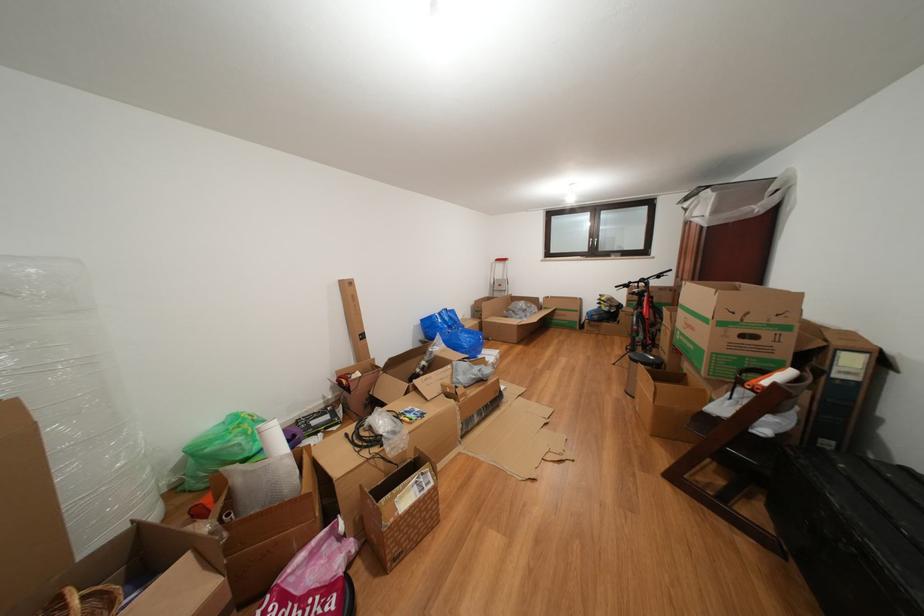
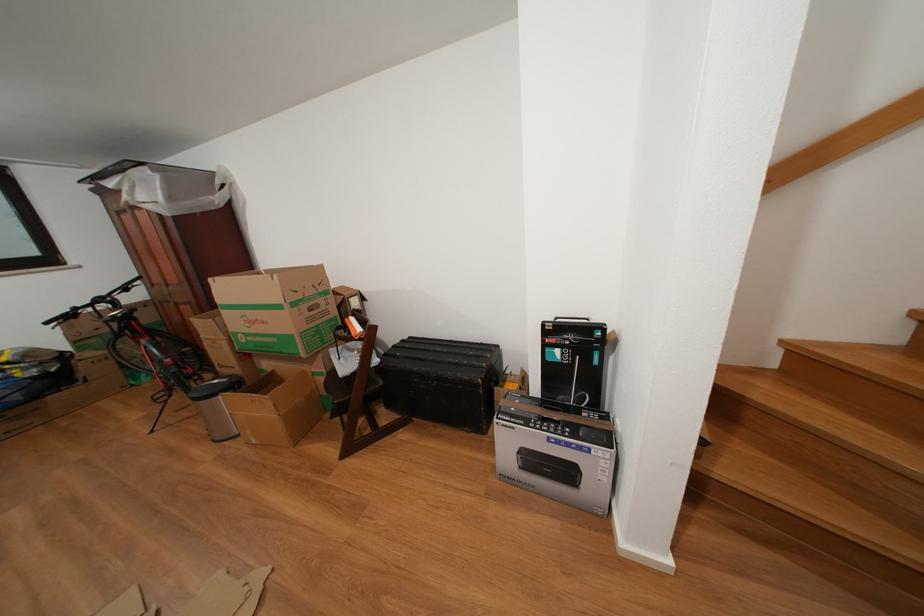
The first image is from the beginning of the video and the second image is from the end. How did the camera likely rotate when shooting the video?

The rotation direction of the camera is right-down.